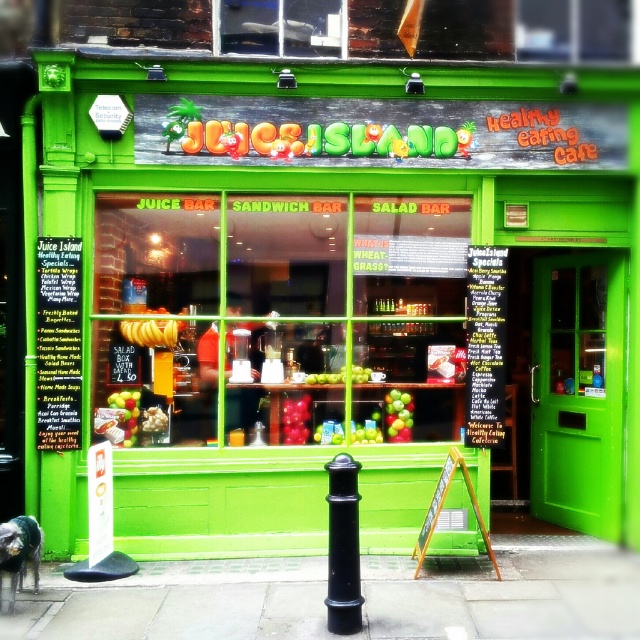
Question: Which of the following is the farthest from the observer?

Choices:
 (A) (36, 240)
 (B) (404, 406)

Answer: (B)

Question: Which point appears farthest from the camera in this image?

Choices:
 (A) (406, 419)
 (B) (113, 419)
 (C) (68, 608)

Answer: (A)

Question: Estimate the real-world distances between objects in this image. Which object is closer to the yellow matte bananas at center?

Choices:
 (A) black polished metal pole at center
 (B) blackboard menu at center
 (C) paved concrete sidewalk at center

Answer: (B)

Question: In this image, where is paved concrete sidewalk at center located relative to green matte apples at center?

Choices:
 (A) right
 (B) left

Answer: (A)

Question: Can you confirm if paved concrete sidewalk at center is bigger than green matte apple at center?

Choices:
 (A) no
 (B) yes

Answer: (B)

Question: Is green matte bananas at left smaller than green matte apple at center?

Choices:
 (A) yes
 (B) no

Answer: (B)